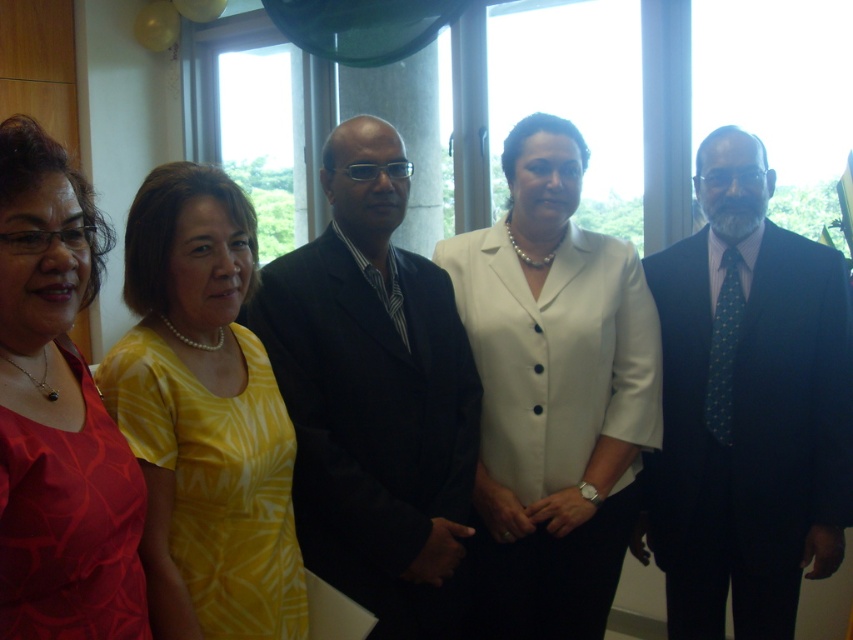
Question: From the image, what is the correct spatial relationship of white satin blouse at center in relation to black suit at center?

Choices:
 (A) above
 (B) below

Answer: (B)

Question: Estimate the real-world distances between objects in this image. Which object is closer to the white satin blouse at center?

Choices:
 (A) black suit at center
 (B) dark blue suit at right
 (C) yellow printed dress at center
 (D) matte red blouse at left

Answer: (A)

Question: Is white satin blouse at center to the left of matte red blouse at left from the viewer's perspective?

Choices:
 (A) no
 (B) yes

Answer: (A)

Question: Considering the real-world distances, which object is closest to the matte red blouse at left?

Choices:
 (A) black suit at center
 (B) yellow printed dress at center
 (C) dark blue suit at right

Answer: (B)

Question: Among these points, which one is farthest from the camera?

Choices:
 (A) (567, 464)
 (B) (728, 339)

Answer: (B)

Question: Does dark blue suit at right have a larger size compared to matte red blouse at left?

Choices:
 (A) no
 (B) yes

Answer: (B)